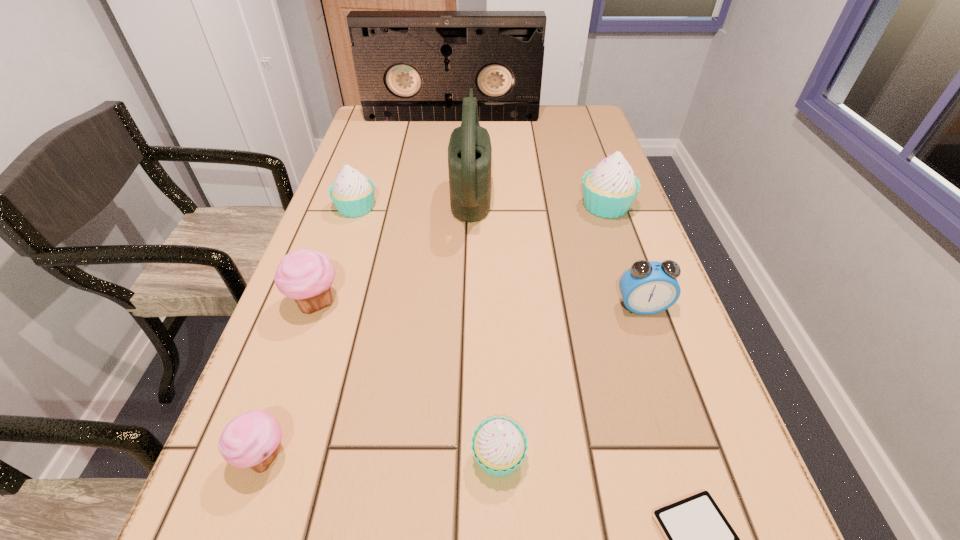
Find the location of a particular element. The width and height of the screenshot is (960, 540). the tallest object is located at coordinates (410, 65).

The width and height of the screenshot is (960, 540). What are the coordinates of `the farthest object` in the screenshot? It's located at (410, 65).

At what (x,y) coordinates should I click in order to perform the action: click on green watering can. Please return your answer as a coordinate pair (x, y). This screenshot has width=960, height=540. Looking at the image, I should click on (469, 151).

Image resolution: width=960 pixels, height=540 pixels. What are the coordinates of `the eighth shortest object` in the screenshot? It's located at (469, 151).

What are the coordinates of `the biggest white cupcake` in the screenshot? It's located at (609, 189).

You are a GUI agent. You are given a task and a screenshot of the screen. Output one action in this format:
    pyautogui.click(x=<x>, y=<y>)
    Task: Click on the rightmost cupcake
    
    Given the screenshot: What is the action you would take?
    pyautogui.click(x=609, y=189)

In order to click on the second biggest white cupcake in this screenshot , I will do `click(352, 193)`.

This screenshot has width=960, height=540. What are the coordinates of `the third farthest cupcake` in the screenshot? It's located at (305, 275).

Locate an element on the screen. the bigger pink cupcake is located at coordinates (305, 275).

This screenshot has height=540, width=960. Find the location of `alarm clock`. alarm clock is located at coordinates (649, 287).